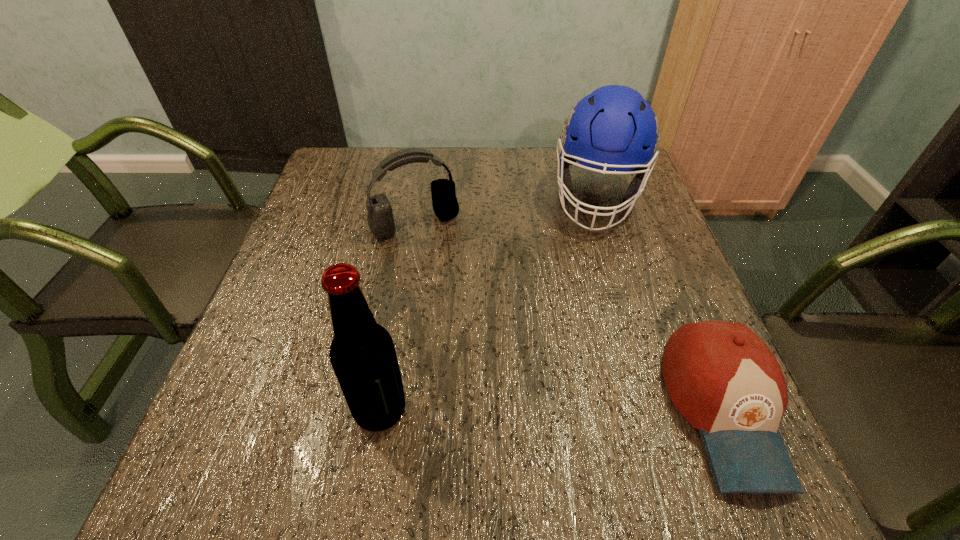
Where is `vacant space located 0.260m on the face guard of the football helmet`? vacant space located 0.260m on the face guard of the football helmet is located at coordinates (586, 318).

In order to click on object at the far edge in this screenshot , I will do `click(613, 128)`.

At what (x,y) coordinates should I click in order to perform the action: click on beer bottle present at the near edge. Please return your answer as a coordinate pair (x, y). Looking at the image, I should click on (362, 353).

Identify the location of baseball cap at the near edge. click(723, 379).

Locate an element on the screen. The image size is (960, 540). baseball cap present at the right edge is located at coordinates (723, 379).

You are a GUI agent. You are given a task and a screenshot of the screen. Output one action in this format:
    pyautogui.click(x=<x>, y=<y>)
    Task: Click on the football helmet positioned at the right edge
    The height and width of the screenshot is (540, 960).
    Given the screenshot: What is the action you would take?
    pyautogui.click(x=613, y=128)

This screenshot has width=960, height=540. Identify the location of object located in the far right corner section of the desktop. (613, 128).

Find the location of a particular element. object that is at the near right corner is located at coordinates (723, 379).

This screenshot has height=540, width=960. I want to click on vacant area at the far edge, so 408,188.

Image resolution: width=960 pixels, height=540 pixels. Find the location of `vacant region at the near edge of the desktop`. vacant region at the near edge of the desktop is located at coordinates pos(580,410).